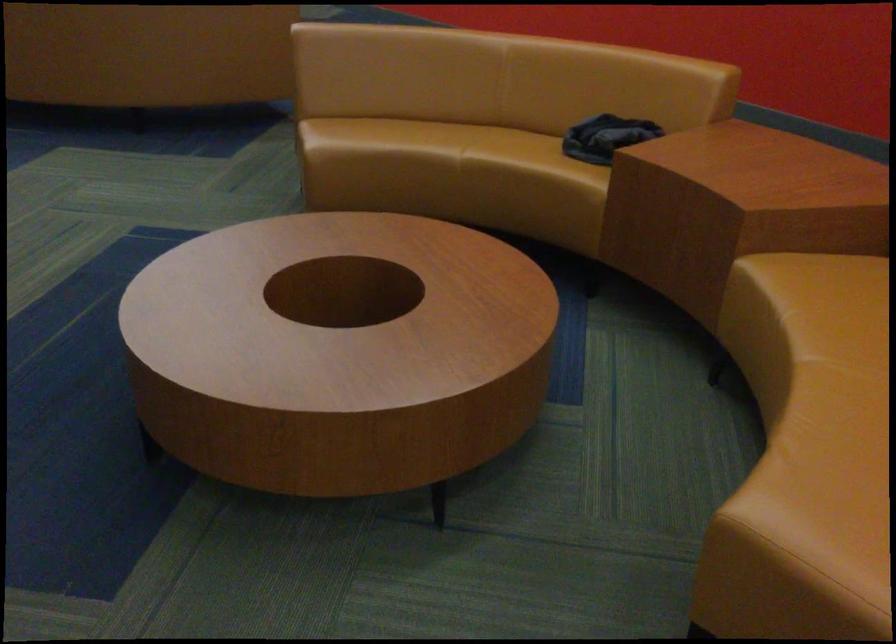
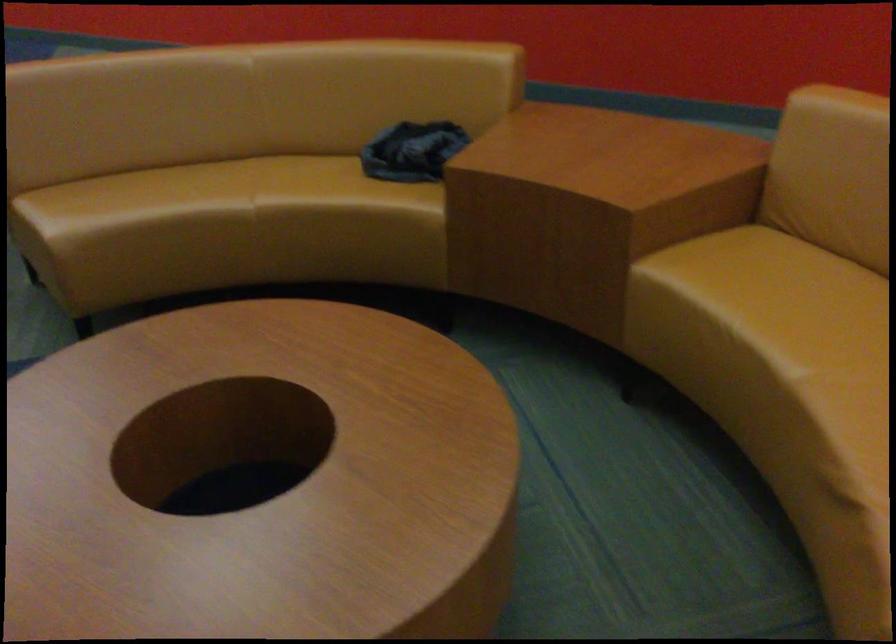
In a continuous first-person perspective shot, in which direction is the camera moving?

The cameraman moved toward left, forward.